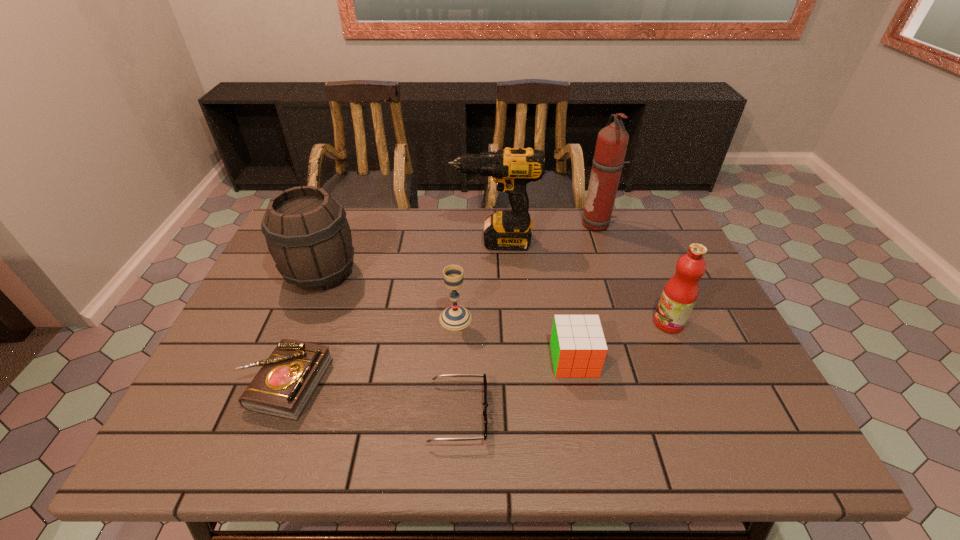
The height and width of the screenshot is (540, 960). Identify the location of object that is positioned at the right edge. (680, 293).

Find the location of a particular element. This screenshot has width=960, height=540. object that is positioned at the far left corner is located at coordinates (307, 233).

Where is `object at the near left corner`? The image size is (960, 540). object at the near left corner is located at coordinates (285, 383).

In order to click on vacant space at the far edge in this screenshot , I will do `click(394, 247)`.

The height and width of the screenshot is (540, 960). In the image, there is a desktop. Identify the location of vacant space at the near edge. (280, 457).

Find the location of a particular element. This screenshot has height=540, width=960. free space at the left edge of the desktop is located at coordinates (247, 410).

The height and width of the screenshot is (540, 960). Find the location of `vacant space at the right edge of the desktop`. vacant space at the right edge of the desktop is located at coordinates (656, 271).

I want to click on free space at the far right corner of the desktop, so click(x=637, y=226).

This screenshot has width=960, height=540. I want to click on empty space that is in between the tallest object and the drill, so click(546, 233).

Where is `empty location between the rightmost object and the second tallest object`? empty location between the rightmost object and the second tallest object is located at coordinates pos(582,282).